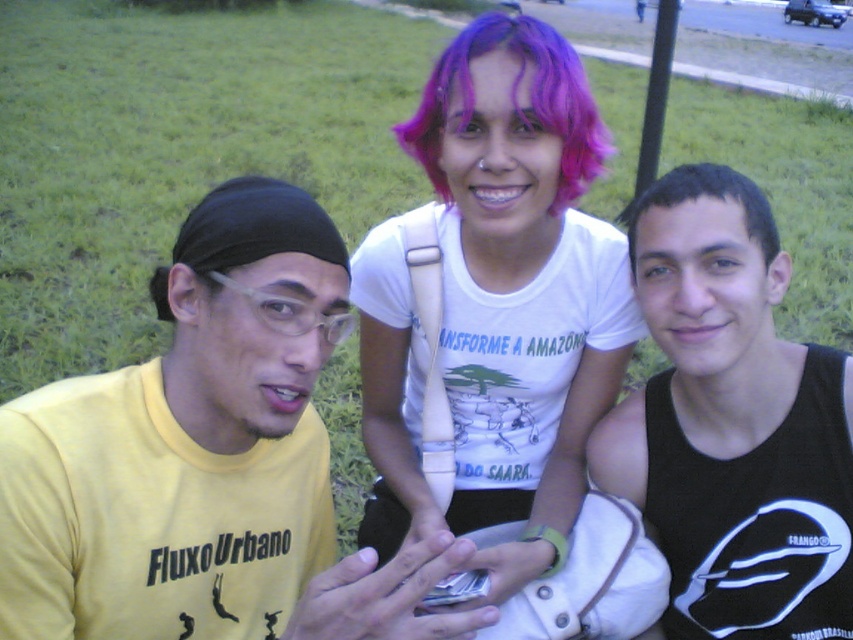
Is purple hair at center smaller than dark brown hair at right?

Incorrect, purple hair at center is not smaller in size than dark brown hair at right.

Is purple hair at center closer to the viewer compared to dark brown hair at right?

Yes.

Who is more distant from viewer, (592, 404) or (639, 212)?

→ The point (592, 404) is behind.

Locate an element on the screen. purple hair at center is located at coordinates (497, 305).

Looking at this image, can you confirm if yellow matte t-shirt at left is positioned to the left of black tank top at right?

Indeed, yellow matte t-shirt at left is positioned on the left side of black tank top at right.

Is point (399, 609) closer to camera compared to point (740, 200)?

That is True.

You are a GUI agent. You are given a task and a screenshot of the screen. Output one action in this format:
    pyautogui.click(x=<x>, y=<y>)
    Task: Click on the yellow matte t-shirt at left
    This screenshot has width=853, height=640.
    Given the screenshot: What is the action you would take?
    pyautogui.click(x=206, y=460)

Identify the location of purple hair at center. (497, 305).

The height and width of the screenshot is (640, 853). I want to click on purple hair at center, so click(x=497, y=305).

In order to click on purple hair at center in this screenshot , I will do `click(497, 305)`.